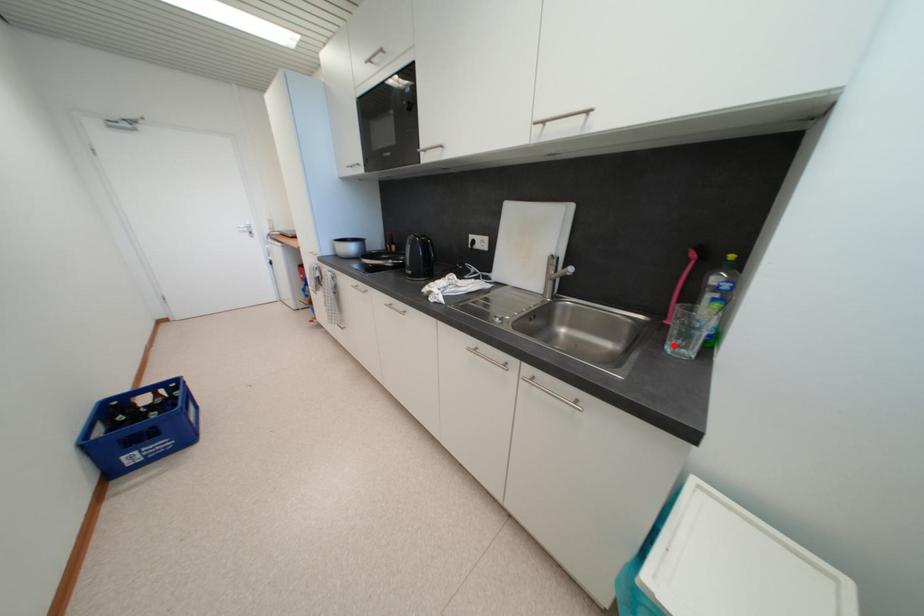
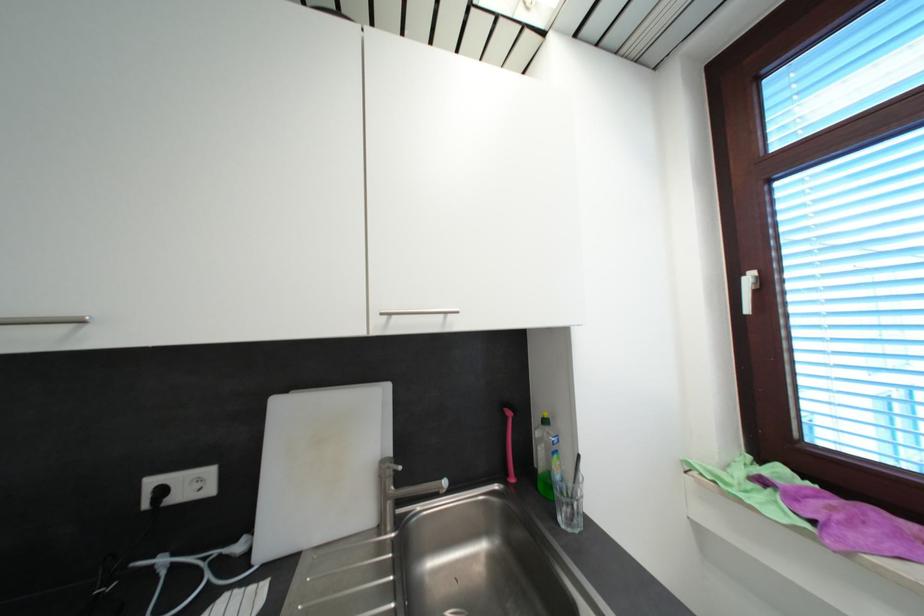
Question: I am providing you with two images of the same scene from different viewpoints. A red point is shown in image1. For the corresponding object point in image2, is it positioned nearer or farther from the camera?

Choices:
 (A) Nearer
 (B) Farther

Answer: (B)